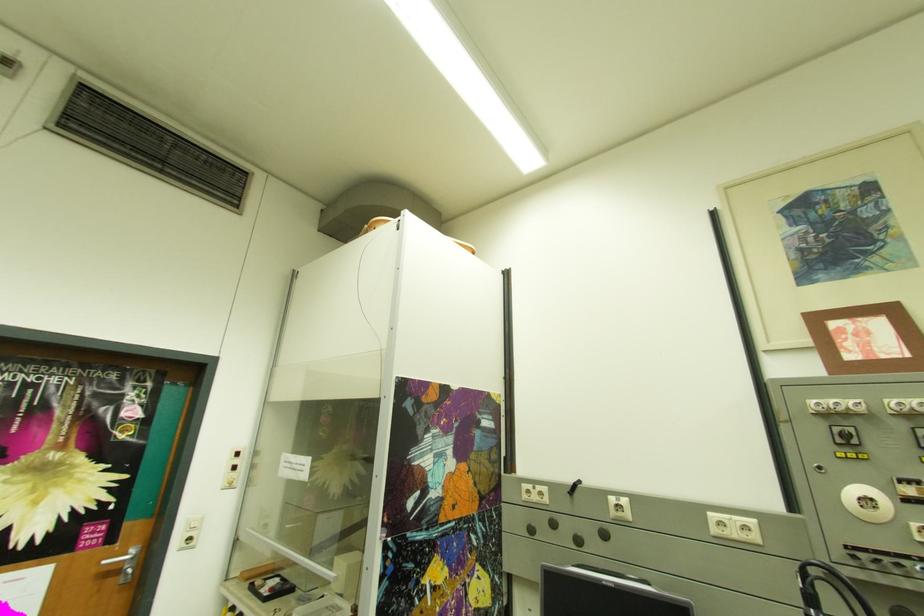
Find where to press the black rocker switch. Please return your answer as a coordinate pair (x, y).

(845, 436)